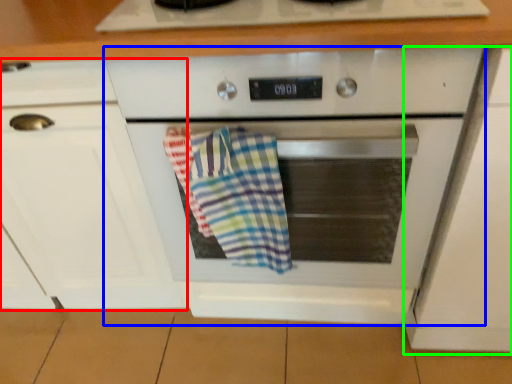
Question: Which object is positioned closest to cabinetry (highlighted by a red box)? Select from oven (highlighted by a blue box) and cabinetry (highlighted by a green box).

Choices:
 (A) oven
 (B) cabinetry

Answer: (A)